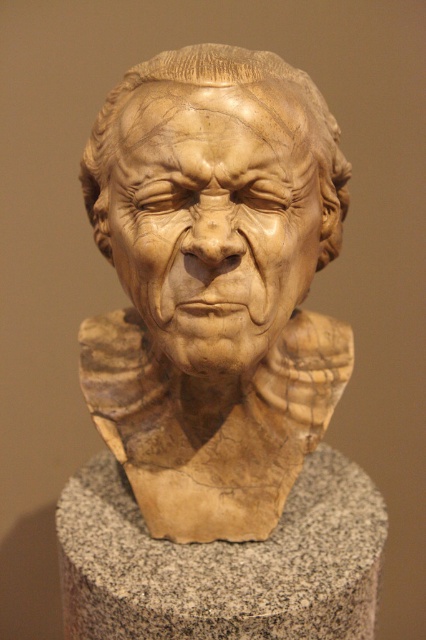
You are an art conservator examining the sculpture. You notice a small crack at point (213, 285). Where exactly is this crack located on the sculpture?

The crack is located at point (213, 285), which is at the center of the marble bust.

In the scene shown: You are an art conservator standing in front of the sculpture. Your arms can reach up to 1.2 meters. You need to clean the marble bust at center. Can you reach it without moving closer?

The marble bust at center is 1.08 meters away from the viewer. Since your arms can reach up to 1.2 meters, you can reach the marble bust at center without moving closer.

You are an art conservator assessing the stability of the sculpture. Given that the marble bust at center has a narrower base compared to the granite pedestal at center, which part is more likely to tip over if the sculpture is moved?

The marble bust at center is more likely to tip over because it is thinner than the granite pedestal at center, making its base narrower and less stable.